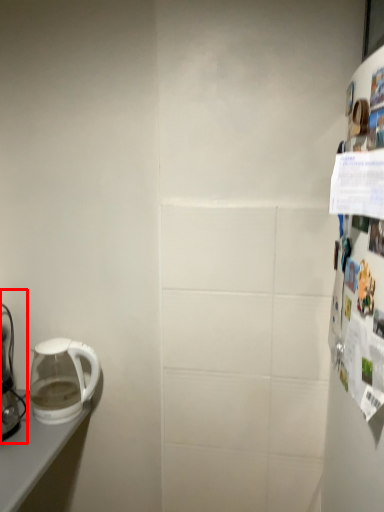
Question: From the image's perspective, considering the relative positions of coffee maker (annotated by the red box) and kettle in the image provided, where is coffee maker (annotated by the red box) located with respect to the staircase?

Choices:
 (A) below
 (B) above

Answer: (B)